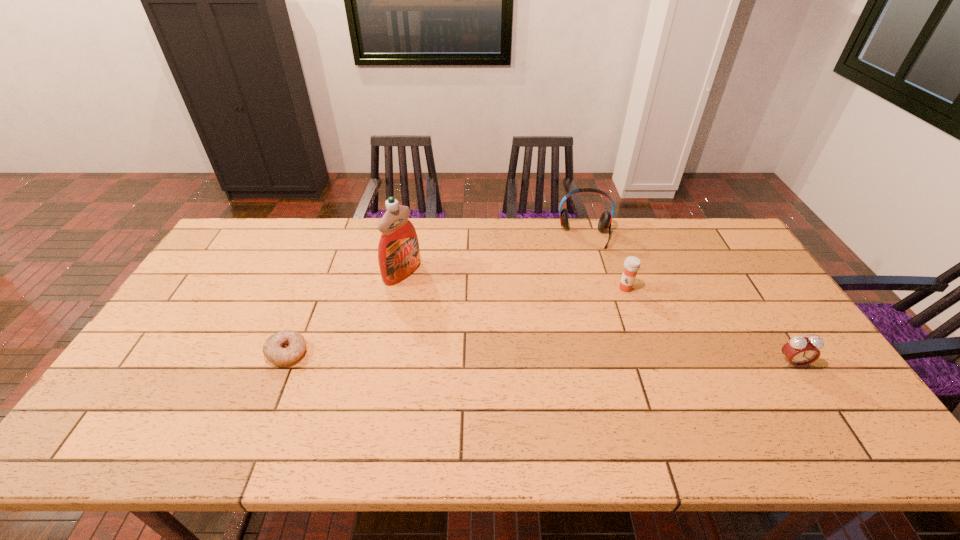
At what (x,y) coordinates should I click in order to perform the action: click on vacant space on the desktop that is between the leftmost object and the rightmost object and is positioned on the label side of the medicine. Please return your answer as a coordinate pair (x, y). Looking at the image, I should click on (577, 359).

The width and height of the screenshot is (960, 540). I want to click on vacant spot on the desktop that is between the leftmost object and the rightmost object and is positioned on the front surface of the tallest object, so click(562, 359).

Locate an element on the screen. vacant space on the desktop that is between the leftmost object and the rightmost object and is positioned with the microphone attached to the side of the second tallest object is located at coordinates (597, 359).